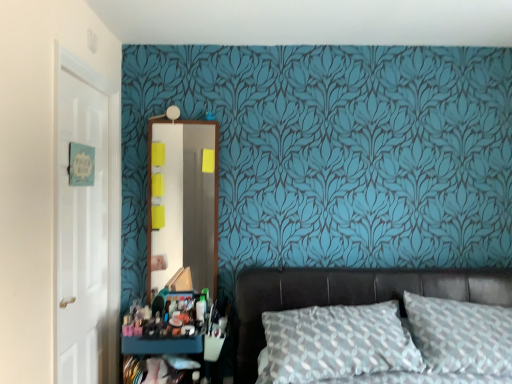
What do you see at coordinates (343, 296) in the screenshot?
I see `leather bed at lower right` at bounding box center [343, 296].

This screenshot has height=384, width=512. Identify the location of matte black dresser at lower left. (170, 338).

What do you see at coordinates (170, 316) in the screenshot? I see `matte plastic makeup at lower left` at bounding box center [170, 316].

What do you see at coordinates (461, 335) in the screenshot? Image resolution: width=512 pixels, height=384 pixels. I see `textured gray pillow at center` at bounding box center [461, 335].

This screenshot has width=512, height=384. Find the location of `leather bed at lower right`. leather bed at lower right is located at coordinates (343, 296).

From the image's perspective, is leather bed at lower right above or below white glossy door at left?

leather bed at lower right is situated lower than white glossy door at left in the image.

From their relative heights in the image, would you say leather bed at lower right is taller or shorter than white glossy door at left?

In the image, leather bed at lower right appears to be shorter than white glossy door at left.

Where is `door that is above the leather bed at lower right (from a real-world perspective)`? Image resolution: width=512 pixels, height=384 pixels. door that is above the leather bed at lower right (from a real-world perspective) is located at coordinates (81, 227).

From a real-world perspective, is leather bed at lower right beneath white glossy door at left?

Indeed, from a real-world perspective, leather bed at lower right is positioned beneath white glossy door at left.

Is white glossy door at left taller or shorter than matte black dresser at lower left?

In the image, white glossy door at left appears to be taller than matte black dresser at lower left.

From the image's perspective, is white glossy door at left beneath matte black dresser at lower left?

No.

Is textured gray pillow at center placed right next to white glossy door at left?

No, textured gray pillow at center is not making contact with white glossy door at left.

Which point is more distant from viewer, (424, 339) or (106, 127)?

The point (106, 127) is farther from the camera.

Could you tell me if textured gray pillow at center is turned towards white glossy door at left?

No.

Can you confirm if textured gray pillow at center is positioned to the right of wooden mirror at center?

Correct, you'll find textured gray pillow at center to the right of wooden mirror at center.

Is textured gray pillow at center wider or thinner than wooden mirror at center?

Clearly, textured gray pillow at center has more width compared to wooden mirror at center.

Is textured gray pillow at center smaller than wooden mirror at center?

No, textured gray pillow at center is not smaller than wooden mirror at center.

What are the coordinates of `pillow located underneath the wooden mirror at center (from a real-world perspective)` in the screenshot? It's located at (461, 335).

Is leather bed at lower right located outside wooden mirror at center?

leather bed at lower right is positioned outside wooden mirror at center.

From the image's perspective, is leather bed at lower right under wooden mirror at center?

Yes, from the image's perspective, leather bed at lower right is beneath wooden mirror at center.

Is wooden mirror at center at the back of leather bed at lower right?

That's not correct — leather bed at lower right is not looking away from wooden mirror at center.

Considering the positions of point (74, 299) and point (250, 341), is point (74, 299) closer or farther from the camera than point (250, 341)?

Point (74, 299) is closer to the camera than point (250, 341).

Considering the relative positions of white glossy door at left and leather bed at lower right in the image provided, is white glossy door at left behind leather bed at lower right?

No, it is in front of leather bed at lower right.

Is white glossy door at left inside or outside of leather bed at lower right?

The correct answer is: outside.

Between white glossy door at left and leather bed at lower right, which one has larger size?

Bigger between the two is leather bed at lower right.

Is textured gray pillow at center inside or outside of matte black dresser at lower left?

textured gray pillow at center exists outside the volume of matte black dresser at lower left.

From a real-world perspective, which is physically above, textured gray pillow at center or matte black dresser at lower left?

textured gray pillow at center.

From the picture: Does textured gray pillow at center appear on the left side of matte black dresser at lower left?

Incorrect, textured gray pillow at center is not on the left side of matte black dresser at lower left.

Between point (426, 333) and point (163, 315), which one is positioned in front?

The point (426, 333) is in front.

Identify the location of door in front of the leather bed at lower right. Image resolution: width=512 pixels, height=384 pixels. (81, 227).

This screenshot has width=512, height=384. Find the location of `door above the matte black dresser at lower left (from a real-world perspective)`. door above the matte black dresser at lower left (from a real-world perspective) is located at coordinates (81, 227).

Based on their spatial positions, is wooden mirror at center or matte black dresser at lower left closer to leather bed at lower right?

The object closer to leather bed at lower right is matte black dresser at lower left.

Estimate the real-world distances between objects in this image. Which object is further from textured gray pillow at center, matte black dresser at lower left or wooden mirror at center?

wooden mirror at center is further to textured gray pillow at center.

Considering their positions, is wooden mirror at center positioned further to matte black dresser at lower left than matte plastic makeup at lower left?

Based on the image, wooden mirror at center appears to be further to matte black dresser at lower left.

Based on their spatial positions, is wooden mirror at center or matte black dresser at lower left closer to textured gray pillow at center?

Based on the image, matte black dresser at lower left appears to be nearer to textured gray pillow at center.

Considering their positions, is matte plastic makeup at lower left positioned further to white glossy door at left than wooden mirror at center?

Based on the image, matte plastic makeup at lower left appears to be further to white glossy door at left.

Based on their spatial positions, is textured gray pillow at center or matte black dresser at lower left closer to white glossy door at left?

Based on the image, matte black dresser at lower left appears to be nearer to white glossy door at left.

Which object lies further to the anchor point wooden mirror at center, leather bed at lower right or matte plastic makeup at lower left?

leather bed at lower right is positioned further to the anchor wooden mirror at center.

Estimate the real-world distances between objects in this image. Which object is closer to wooden mirror at center, matte black dresser at lower left or white glossy door at left?

The object closer to wooden mirror at center is matte black dresser at lower left.

You are a GUI agent. You are given a task and a screenshot of the screen. Output one action in this format:
    pyautogui.click(x=<x>, y=<y>)
    Task: Click on the stuff positioned between white glossy door at left and wooden mirror at center from near to far
    The height and width of the screenshot is (384, 512).
    Given the screenshot: What is the action you would take?
    pyautogui.click(x=170, y=316)

Image resolution: width=512 pixels, height=384 pixels. I want to click on bed situated between matte black dresser at lower left and textured gray pillow at center from left to right, so click(343, 296).

You are a GUI agent. You are given a task and a screenshot of the screen. Output one action in this format:
    pyautogui.click(x=<x>, y=<y>)
    Task: Click on the bed between matte plastic makeup at lower left and textured gray pillow at center from left to right
    
    Given the screenshot: What is the action you would take?
    [343, 296]

Where is `stuff between matte black dresser at lower left and leather bed at lower right from left to right`? The image size is (512, 384). stuff between matte black dresser at lower left and leather bed at lower right from left to right is located at coordinates (170, 316).